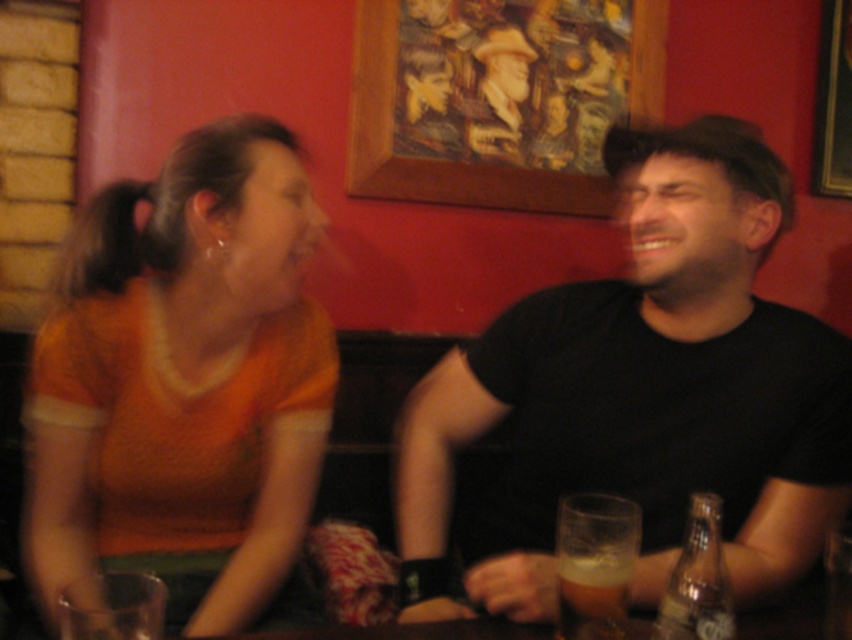
Please describe the position of the black matte shirt at center in terms of coordinates within the image frame. The image frame has its origin at the bottom left corner, with x increasing to the right and y increasing upwards.

The black matte shirt at center is located at coordinates x 0.611 and y 0.758 within the image frame.

You are a waiter holding a 12 inch long tray. You need to place the tray between the black matte shirt at center and the foamy amber beer at lower center. Can you fit the tray there?

The distance between the black matte shirt at center and the foamy amber beer at lower center is 14.55 inches. Since the tray is 12 inches long, it can fit in the space between them.

You are standing in front of the bar scene and want to place a small decoration between the two points labeled point (706, 268) and point (147, 403). Which point should the decoration be closer to in order to be nearer to the viewer?

The decoration should be closer to point (706, 268) because it is nearer to the viewer compared to point (147, 403).